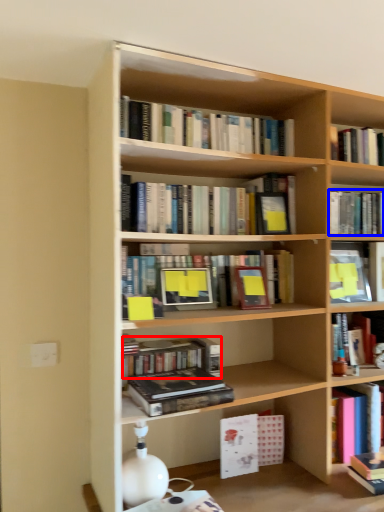
Question: Which object is further to the camera taking this photo, book (highlighted by a red box) or book (highlighted by a blue box)?

Choices:
 (A) book
 (B) book

Answer: (B)